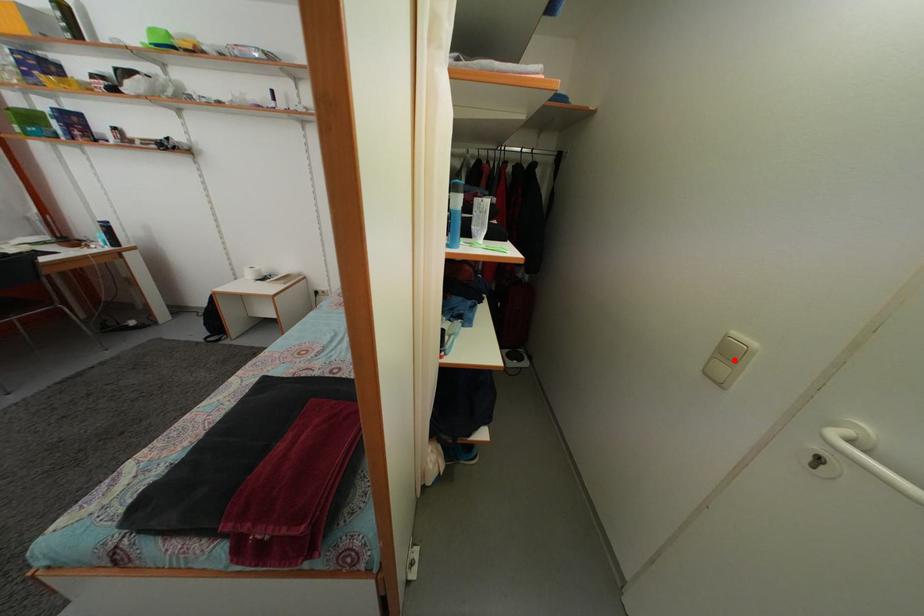
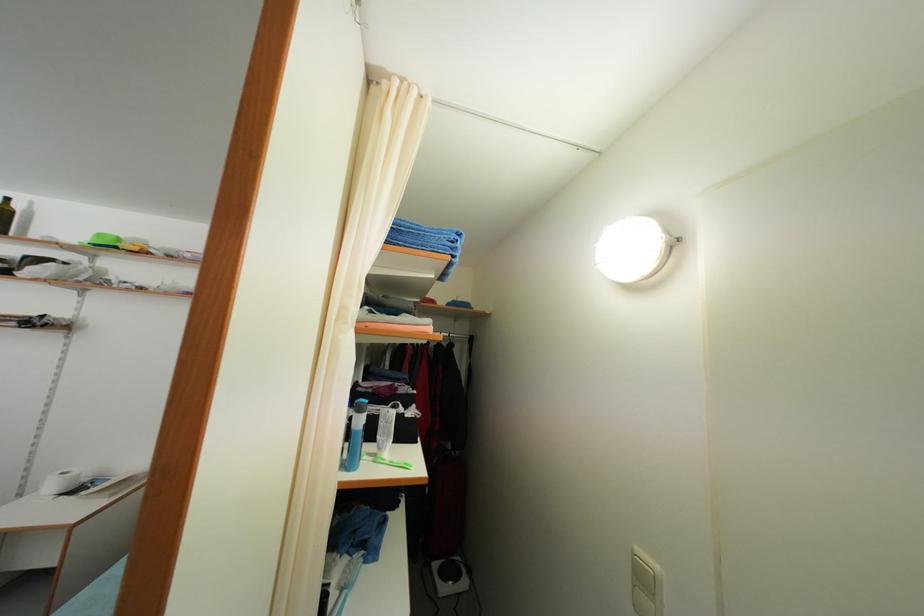
The point at the highlighted location is marked in the first image. Where is the corresponding point in the second image?

(649, 586)